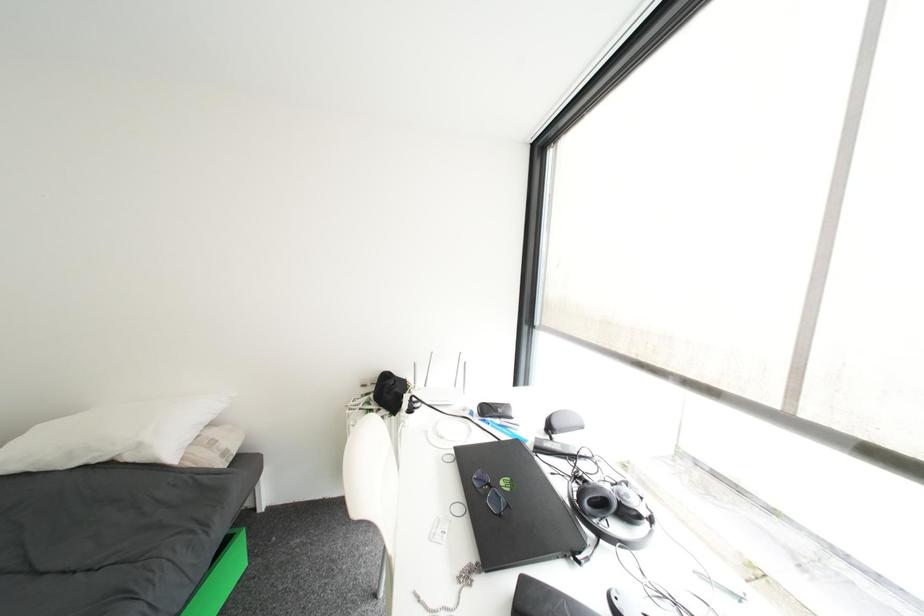
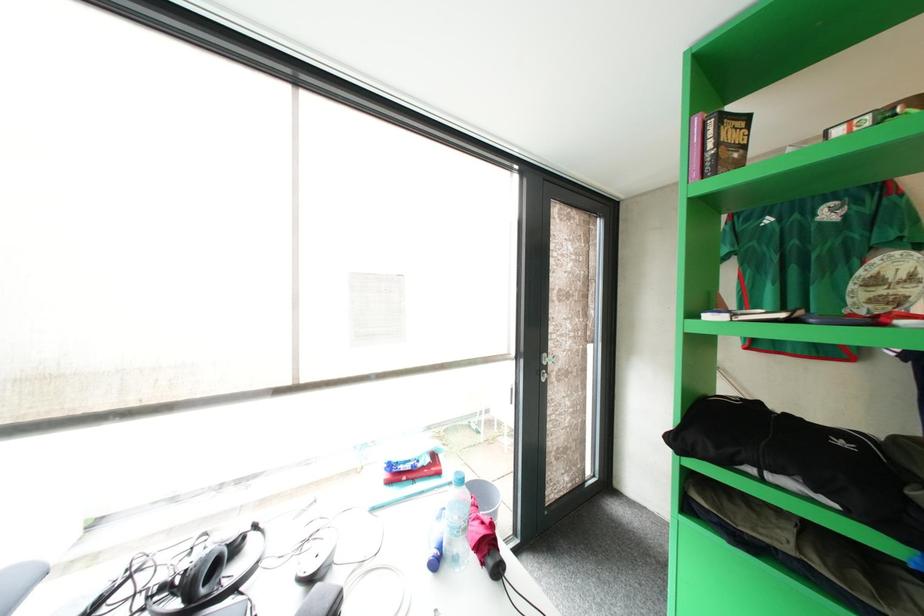
Question: How did the camera likely rotate?

Choices:
 (A) Left
 (B) Right
 (C) Up
 (D) Down

Answer: (B)